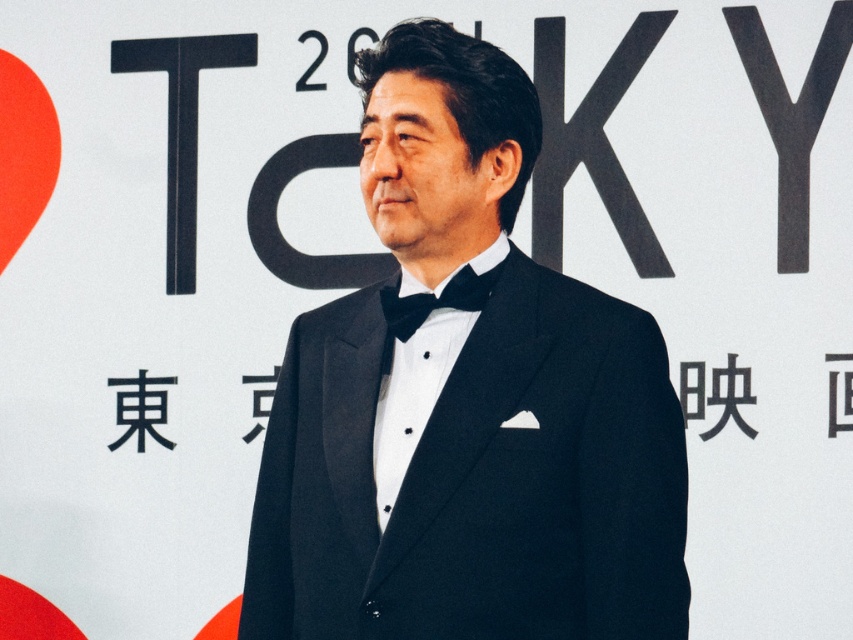
You are a photographer adjusting the camera focus. You need to focus on both the man in the tuxedo and the backdrop with the word TOKYO. Which point, point [305,401] or point [485,275], is closer to the camera lens?

Point [305,401] is closer to the camera lens than point [485,275] because it is further to the viewer.

You are a photographer setting up for a formal event. You need to ensure that the black satin tuxedo at center and the black satin bow tie at center are both visible in the frame. Given their sizes, which one might require more careful framing to ensure it doesn not get lost in the composition?

The black satin bow tie at center is smaller in size compared to the black satin tuxedo at center, so it might require more careful framing to ensure it doesn not get lost in the composition.

You are a photographer adjusting the lighting for a formal portrait. You need to ensure that both the black satin tuxedo at center and the black satin bow tie at center are well lit. Since the tuxedo is on the right side of the bow tie, where should you place the main light to evenly illuminate both?

Since the black satin tuxedo at center is positioned on the right side of the black satin bow tie at center, placing the main light to the left of the subject will help evenly illuminate both the tuxedo and the bow tie.